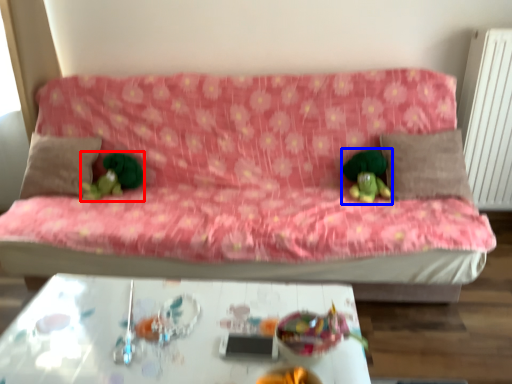
Question: Which object is closer to the camera taking this photo, toy (highlighted by a red box) or miniature (highlighted by a blue box)?

Choices:
 (A) toy
 (B) miniature

Answer: (B)